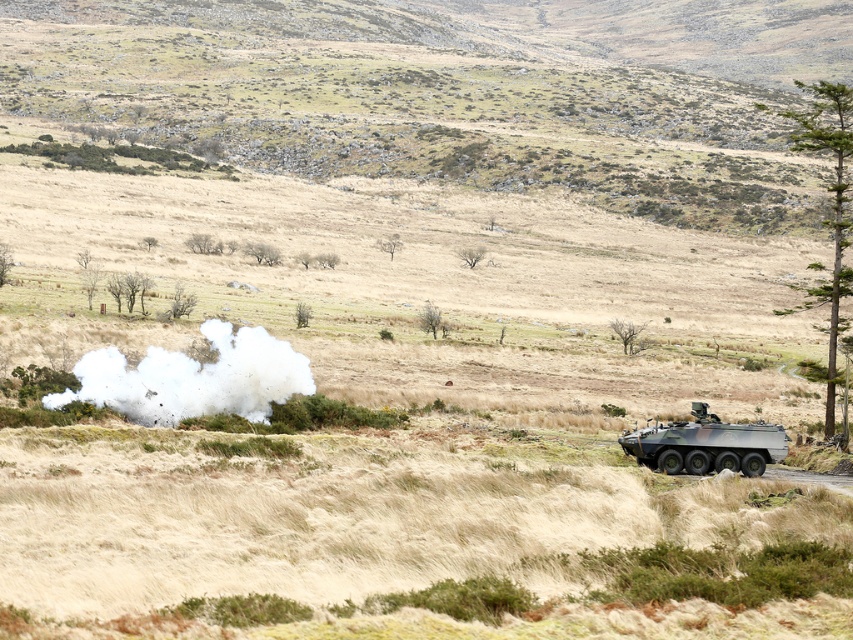
You are a soldier navigating through the rugged landscape depicted in the image. You need to move from point A to point B, which are marked as point (154, 346) and point (741, 440) respectively. Which point should you start from to reach the other without going against the terrain flow?

You should start from point (741, 440) and move towards point (154, 346) because point (154, 346) is behind point (741, 440), indicating it is in a position that follows the terrain flow.

You are a pilot flying a small plane and need to land on a dirt path. You see a white fluffy cloud at left and a camouflage fabric armored vehicle at right. Which object is larger in size?

The white fluffy cloud at left is bigger than the camouflage fabric armored vehicle at right according to the description.

You are a drone operator controlling a small drone that needs to fly from the white fluffy cloud at left to the camouflage fabric armored vehicle at right. Based on the scene, which direction should you direct the drone to move?

The white fluffy cloud at left is positioned on the left side of the camouflage fabric armored vehicle at right, so the drone should move to the right to reach the camouflage fabric armored vehicle at right from the white fluffy cloud at left.